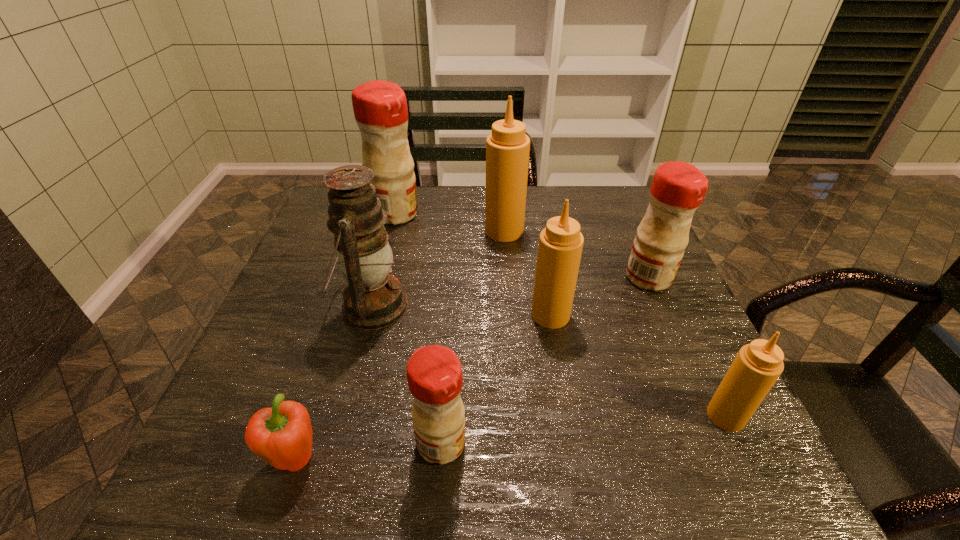
Locate an element on the screen. The width and height of the screenshot is (960, 540). the farthest tan condiment is located at coordinates (507, 148).

The height and width of the screenshot is (540, 960). I want to click on the leftmost condiment, so click(x=380, y=108).

Find the location of a particular element. the farthest red condiment is located at coordinates (380, 108).

The image size is (960, 540). I want to click on lantern, so click(373, 299).

Locate an element on the screen. The image size is (960, 540). the fourth farthest condiment is located at coordinates (560, 246).

Where is `the second farthest tan condiment`? The width and height of the screenshot is (960, 540). the second farthest tan condiment is located at coordinates (560, 246).

You are a GUI agent. You are given a task and a screenshot of the screen. Output one action in this format:
    pyautogui.click(x=<x>, y=<y>)
    Task: Click on the fourth nearest condiment
    
    Given the screenshot: What is the action you would take?
    pyautogui.click(x=678, y=188)

Where is `the rightmost red condiment`? This screenshot has width=960, height=540. the rightmost red condiment is located at coordinates point(678,188).

This screenshot has height=540, width=960. In order to click on the nearest tan condiment in this screenshot , I will do `click(757, 366)`.

The height and width of the screenshot is (540, 960). Identify the location of the rightmost tan condiment. (757, 366).